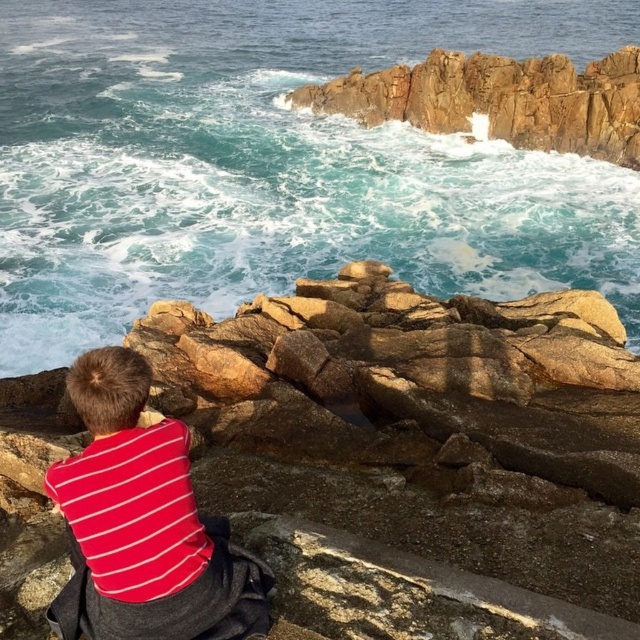
Question: Which point appears farthest from the camera in this image?

Choices:
 (A) (163, 227)
 (B) (362, 88)
 (C) (240, 525)
 (D) (76, 388)

Answer: (B)

Question: Which object is positioned farthest from the rusty rock at upper center?

Choices:
 (A) red striped shirt at lower left
 (B) brown rough rock at center

Answer: (A)

Question: Does brown rough rock at center have a smaller size compared to red striped shirt at lower left?

Choices:
 (A) no
 (B) yes

Answer: (B)

Question: Can you confirm if blue-green water at upper center is positioned to the left of red striped shirt at lower left?

Choices:
 (A) no
 (B) yes

Answer: (A)

Question: Is blue-green water at upper center positioned at the back of red striped shirt at lower left?

Choices:
 (A) no
 (B) yes

Answer: (B)

Question: Which of these objects is positioned closest to the red striped shirt at lower left?

Choices:
 (A) brown rough rock at center
 (B) blue-green water at upper center

Answer: (A)